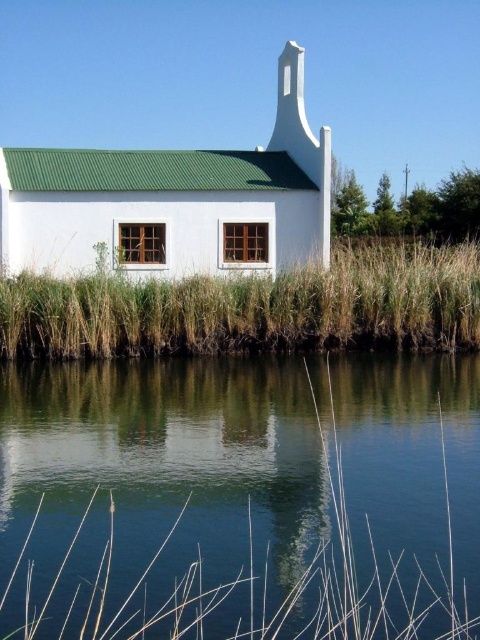
Who is taller, clear blue water at lower center or white matte church at center?

With more height is white matte church at center.

Between clear blue water at lower center and white matte church at center, which one appears on the left side from the viewer's perspective?

white matte church at center

Does point (443, 504) come behind point (172, 209)?

No, it is not.

At what (x,y) coordinates should I click in order to perform the action: click on clear blue water at lower center. Please return your answer as a coordinate pair (x, y). Image resolution: width=480 pixels, height=640 pixels. Looking at the image, I should click on (240, 500).

Who is lower down, white matte church at center or brown grass at lower center?

brown grass at lower center is lower down.

Which is in front, point (62, 198) or point (175, 353)?

Point (175, 353) is in front.

The width and height of the screenshot is (480, 640). What are the coordinates of `white matte church at center` in the screenshot? It's located at (173, 202).

Can you confirm if clear blue water at lower center is positioned above brown grass at lower center?

Actually, clear blue water at lower center is below brown grass at lower center.

Locate an element on the screen. This screenshot has width=480, height=640. clear blue water at lower center is located at coordinates (240, 500).

Does point (310, 582) come closer to viewer compared to point (60, 339)?

Yes.

The width and height of the screenshot is (480, 640). Find the location of `clear blue water at lower center`. clear blue water at lower center is located at coordinates (240, 500).